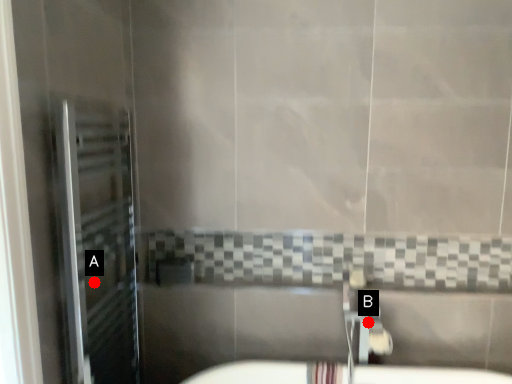
Question: Two points are circled on the image, labeled by A and B beside each circle. Among these points, which one is nearest to the camera?

Choices:
 (A) A is closer
 (B) B is closer

Answer: (A)